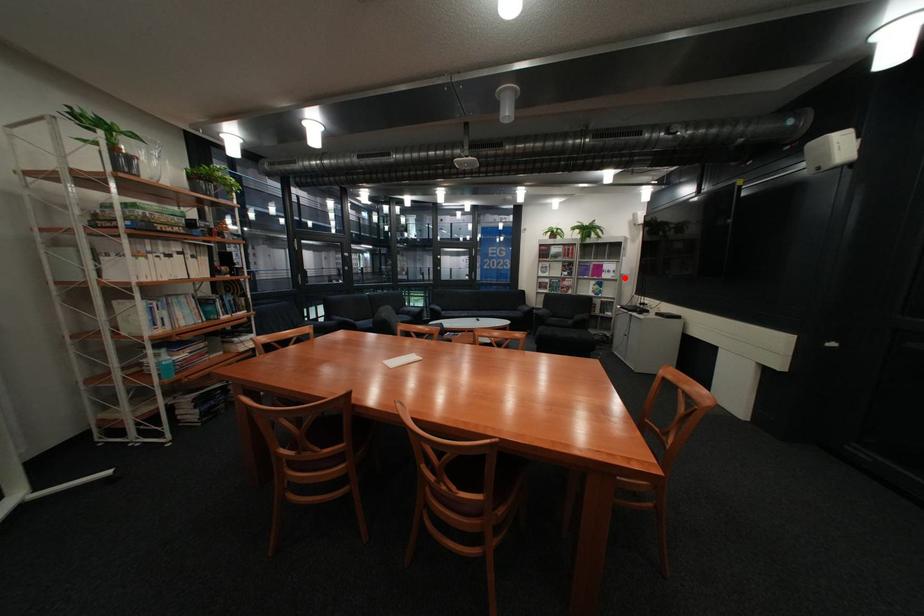
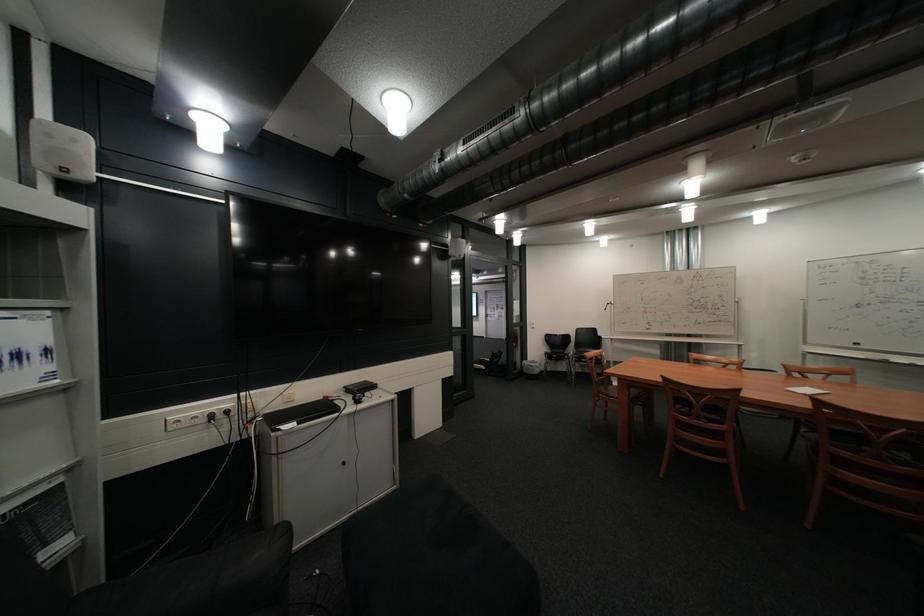
In the second image, find the point that corresponds to the highlighted location in the first image.

(46, 386)